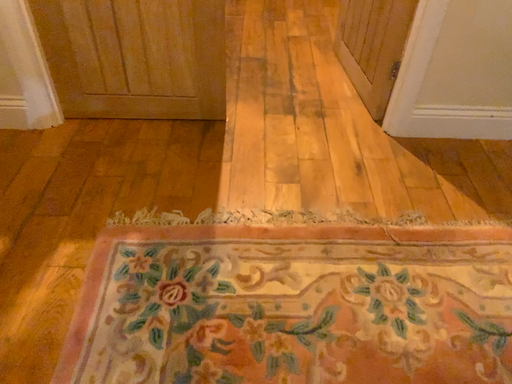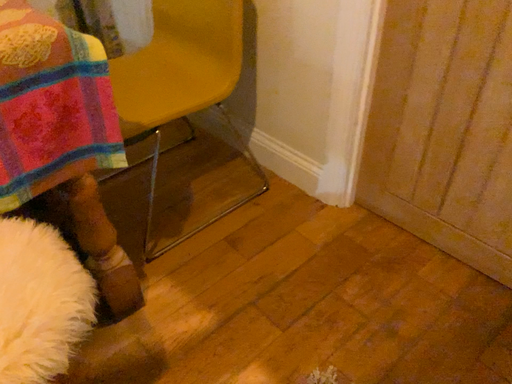
Question: Which way did the camera rotate in the video?

Choices:
 (A) rotated right
 (B) rotated left

Answer: (B)